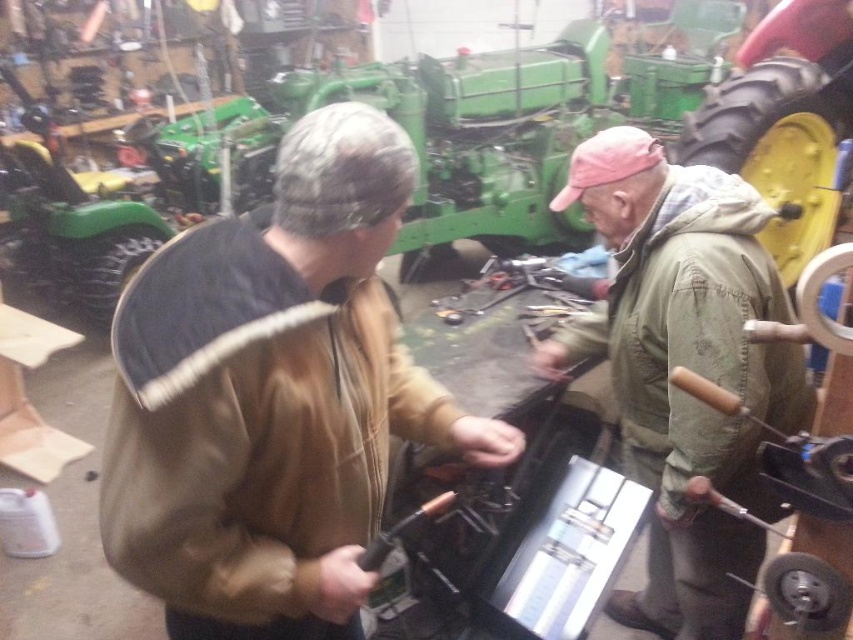
Which is more to the left, metallic silver tool at center or metallic black screwdriver at center?

From the viewer's perspective, metallic black screwdriver at center appears more on the left side.

Between point (538, 262) and point (407, 520), which one is positioned in front?

Positioned in front is point (407, 520).

Is point (514, 275) closer to viewer compared to point (395, 544)?

No, (514, 275) is further to viewer.

At what (x,y) coordinates should I click in order to perform the action: click on metallic silver tool at center. Please return your answer as a coordinate pair (x, y). The height and width of the screenshot is (640, 853). Looking at the image, I should click on (515, 285).

How much distance is there between green canvas jacket at center and metallic silver tool at center?

green canvas jacket at center is 38.73 inches away from metallic silver tool at center.

Is green canvas jacket at center below metallic silver tool at center?

Correct, green canvas jacket at center is located below metallic silver tool at center.

What do you see at coordinates (685, 365) in the screenshot? The width and height of the screenshot is (853, 640). I see `green canvas jacket at center` at bounding box center [685, 365].

This screenshot has height=640, width=853. In order to click on green canvas jacket at center in this screenshot , I will do `click(685, 365)`.

Between brown fuzzy jacket at center and metallic black screwdriver at center, which one appears on the right side from the viewer's perspective?

metallic black screwdriver at center

Where is `brown fuzzy jacket at center`? The image size is (853, 640). brown fuzzy jacket at center is located at coordinates [x=271, y=397].

Identify the location of brown fuzzy jacket at center. (271, 397).